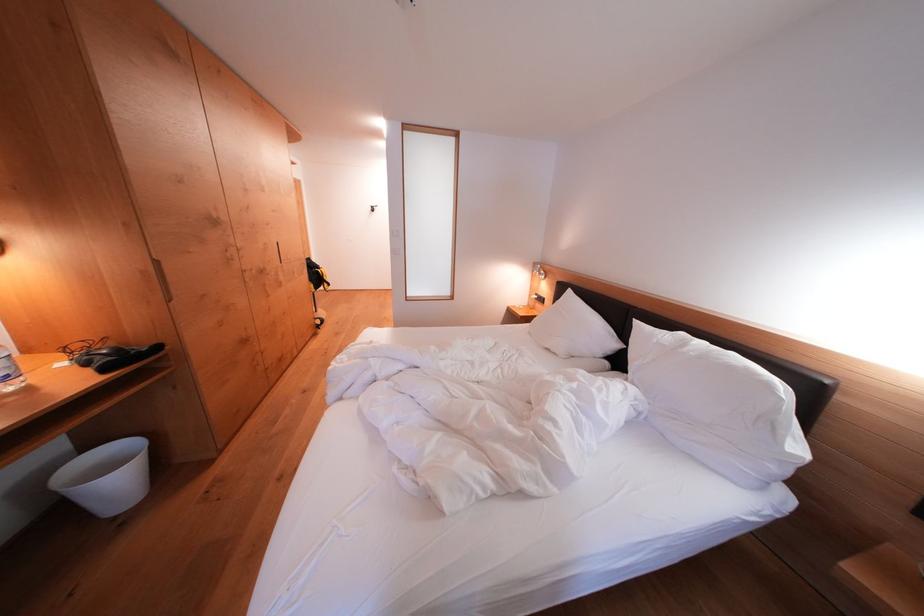
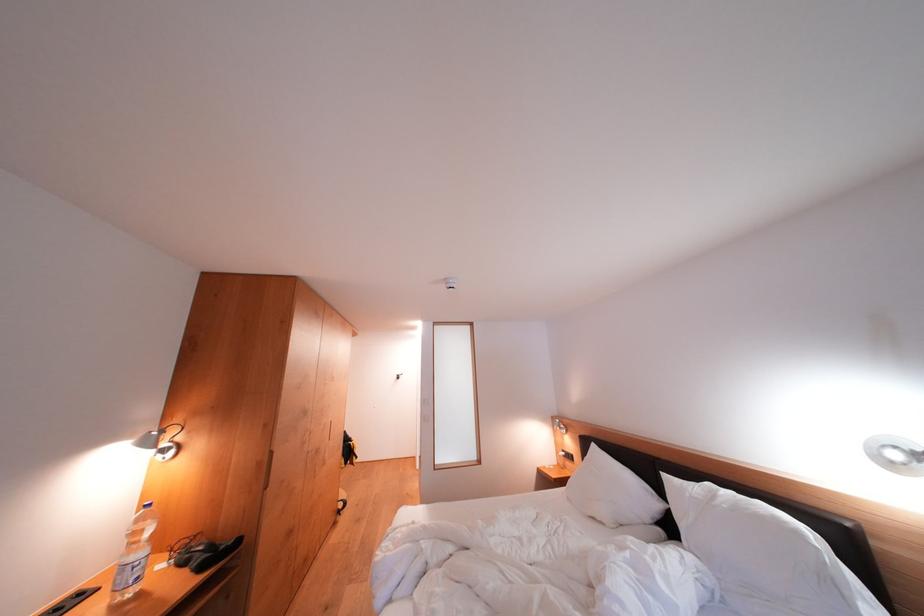
Find the pixel in the second image that matches point (622, 349) in the first image.

(664, 509)